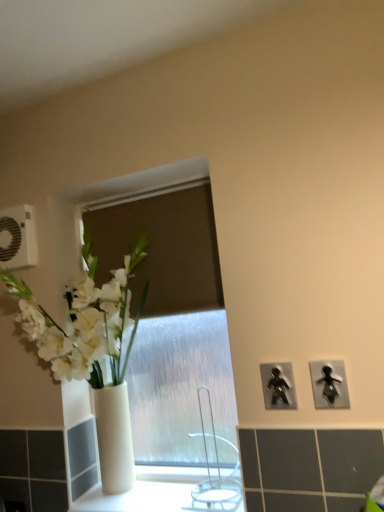
Question: In terms of width, does metallic silver figure at upper right, acting as the 3th electric outlet starting from the back, look wider or thinner when compared to black plastic figure at right, the first electric outlet in the bottom-to-top sequence?

Choices:
 (A) wide
 (B) thin

Answer: (B)

Question: In terms of height, does metallic silver figure at upper right, marked as the third electric outlet in a left-to-right arrangement, look taller or shorter compared to black plastic figure at right, the third electric outlet positioned from the top?

Choices:
 (A) short
 (B) tall

Answer: (A)

Question: Estimate the real-world distances between objects in this image. Which object is closer to the white plastic electric outlet at upper left, which is counted as the 3th electric outlet, starting from the right?

Choices:
 (A) metallic silver figure at upper right, the second electric outlet from the top
 (B) black plastic figure at right, the 2th electric outlet when ordered from right to left
 (C) white glossy vase at left
 (D) silver metallic faucet at center

Answer: (C)

Question: Which object is positioned farthest from the white plastic electric outlet at upper left, arranged as the 1th electric outlet when viewed from the left?

Choices:
 (A) black plastic figure at right, which is the 2th electric outlet in front-to-back order
 (B) white glossy vase at left
 (C) silver metallic faucet at center
 (D) metallic silver figure at upper right, the second electric outlet from the bottom

Answer: (D)